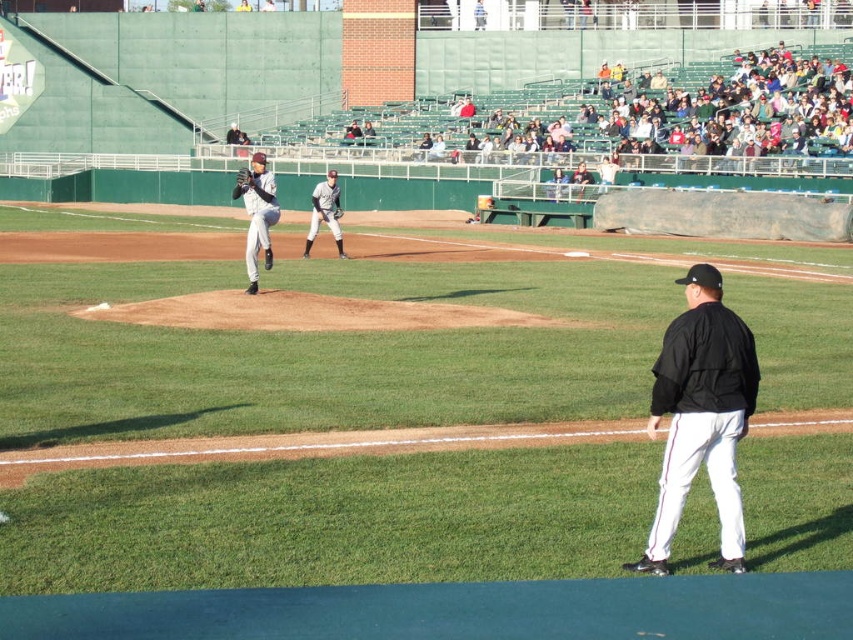
Question: Does gray uniformed pitcher at center come behind gray uniformed player at center?

Choices:
 (A) yes
 (B) no

Answer: (B)

Question: Which of the following is the farthest from the observer?

Choices:
 (A) dark gray leather glove at center
 (B) gray uniformed pitcher at center
 (C) gray uniformed player at center

Answer: (C)

Question: Which point is farther to the camera?

Choices:
 (A) (662, 392)
 (B) (273, 188)

Answer: (B)

Question: Does black matte jacket at right appear on the left side of gray uniformed pitcher at center?

Choices:
 (A) yes
 (B) no

Answer: (B)

Question: Is black matte jacket at right thinner than gray uniformed pitcher at center?

Choices:
 (A) yes
 (B) no

Answer: (A)

Question: Which point is farther to the camera?

Choices:
 (A) dark gray leather glove at center
 (B) black matte jacket at right
 (C) white baseball cap at upper center
 (D) gray uniformed player at center

Answer: (C)